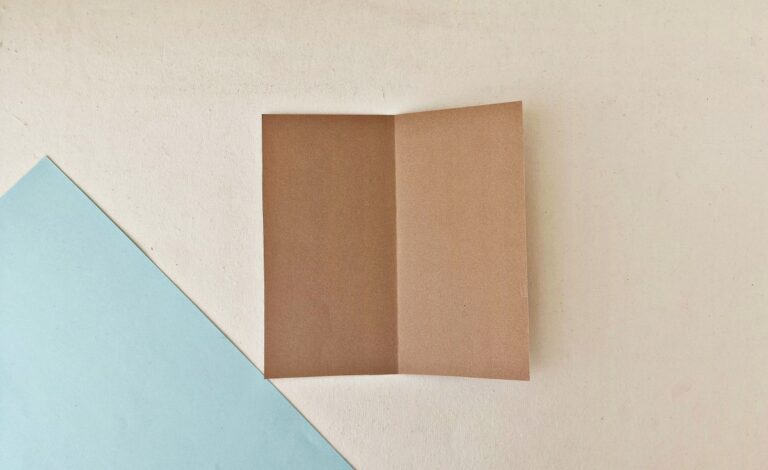
Locate an element on the screen. This screenshot has width=768, height=470. darker part of table is located at coordinates (601, 125).